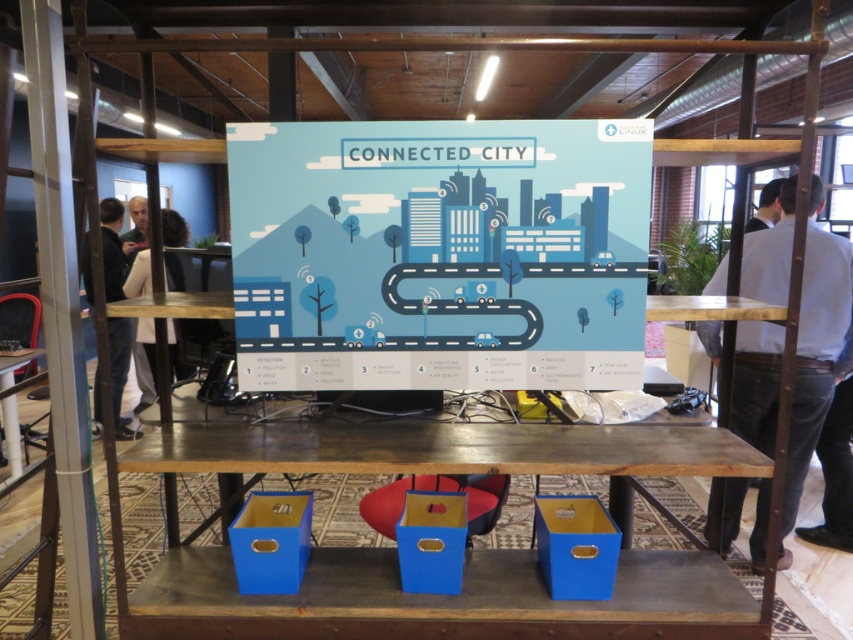
Does matte paper poster at center appear on the left side of dark gray sweater at left?

No, matte paper poster at center is not to the left of dark gray sweater at left.

The height and width of the screenshot is (640, 853). Describe the element at coordinates (439, 253) in the screenshot. I see `matte paper poster at center` at that location.

Identify the location of matte paper poster at center. The image size is (853, 640). (439, 253).

Which is in front, point (651, 564) or point (86, 273)?

Point (651, 564) is in front.

Is blue cardboard boxes at lower center further to the viewer compared to dark gray sweater at left?

No.

Between point (167, 609) and point (120, 268), which one is positioned in front?

Point (167, 609) is more forward.

Where is `blue cardboard boxes at lower center`? blue cardboard boxes at lower center is located at coordinates (444, 600).

Which is below, wooden table at center or blue cardboard box at center?

blue cardboard box at center

Looking at this image, between wooden table at center and blue cardboard box at center, which one appears on the right side from the viewer's perspective?

wooden table at center

Does point (273, 440) come closer to viewer compared to point (432, 529)?

No, it is not.

The width and height of the screenshot is (853, 640). Find the location of `wooden table at center`. wooden table at center is located at coordinates (428, 452).